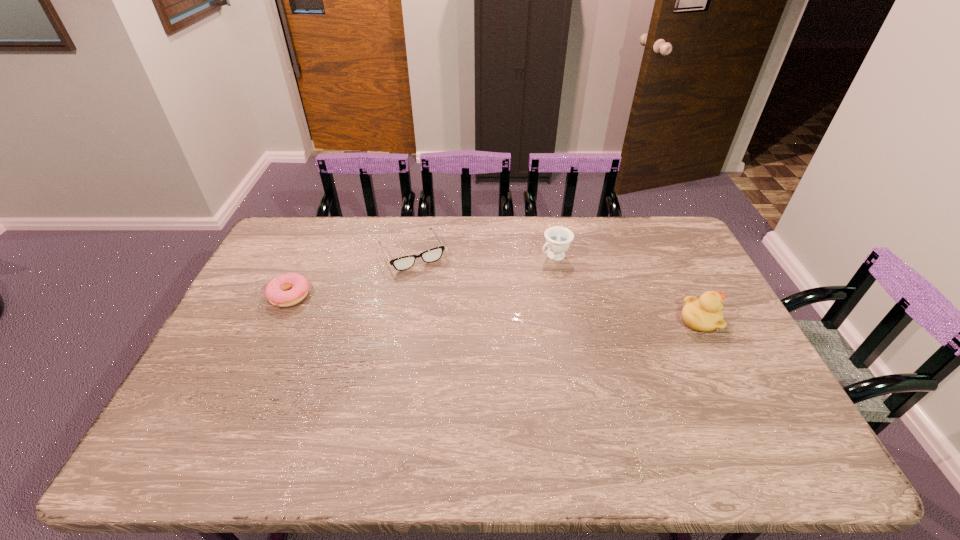
The image size is (960, 540). What are the coordinates of `vacant space on the desktop that is between the leftmost object and the duckling and is positioned on the front-facing side of the second object from left to right` in the screenshot? It's located at (441, 305).

This screenshot has height=540, width=960. I want to click on vacant spot on the desktop that is between the doughnut and the rightmost object and is positioned on the side of the teacup with the handle, so click(x=477, y=307).